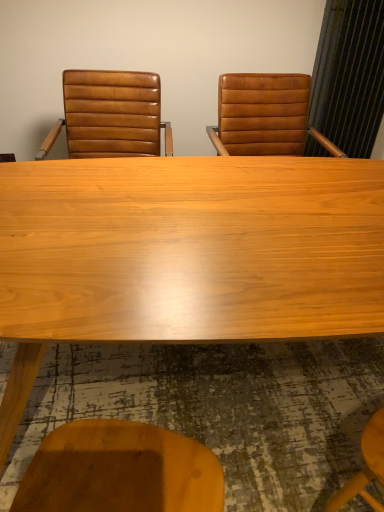
Question: Is point (183, 266) positioned closer to the camera than point (142, 148)?

Choices:
 (A) closer
 (B) farther

Answer: (A)

Question: In terms of size, does light wood table at center appear bigger or smaller than brown leather chair at left?

Choices:
 (A) big
 (B) small

Answer: (A)

Question: Is light wood table at center spatially inside brown leather chair at left, or outside of it?

Choices:
 (A) inside
 (B) outside

Answer: (B)

Question: From the image's perspective, is brown leather chair at left above or below light wood table at center?

Choices:
 (A) above
 (B) below

Answer: (A)

Question: Considering their positions, is brown leather chair at left located in front of or behind light wood table at center?

Choices:
 (A) behind
 (B) front

Answer: (A)

Question: Is brown leather chair at left to the left or to the right of light wood table at center in the image?

Choices:
 (A) right
 (B) left

Answer: (B)

Question: Is brown leather chair at left inside the boundaries of light wood table at center, or outside?

Choices:
 (A) outside
 (B) inside

Answer: (A)